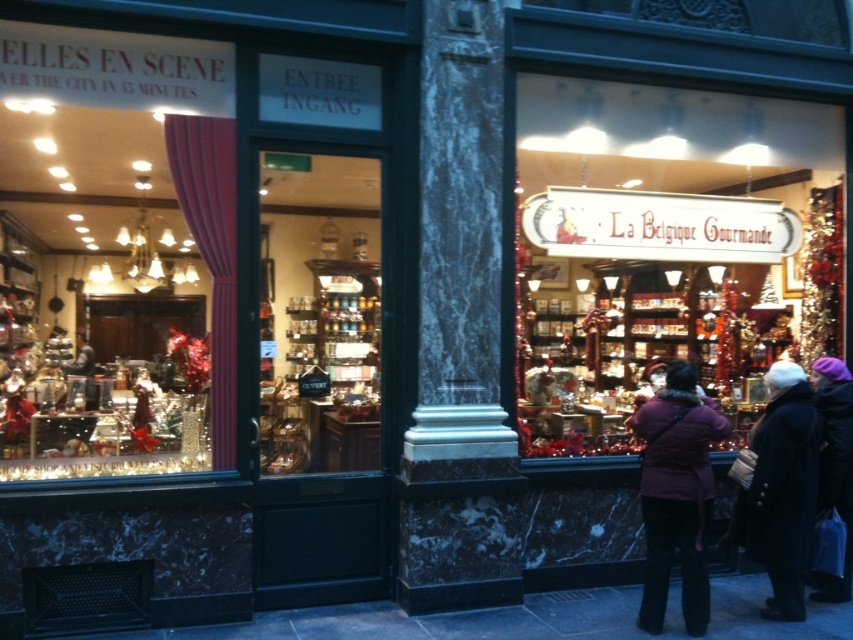
In the scene shown: You are a customer standing in front of the two shops. You want to buy a purple woolen hat. Which shop should you enter? The one with the matte white signboard at center or the one with the purple woolen hat at upper right?

The purple woolen hat at upper right is located in the shop on the right, which has the sign La Belgique Gourmande. Therefore, you should enter the shop with the purple woolen hat at upper right to buy the hat.

You are standing in front of the two shops and want to place a new decorative item between the matte white signboard at center and the purple fuzzy coat at lower right. Based on their current positions, which object should the new item be placed closer to?

The new decorative item should be placed closer to the purple fuzzy coat at lower right because the matte white signboard at center is positioned on the left side of the purple fuzzy coat at lower right, meaning the signboard is further to the left and the coat is to the right.